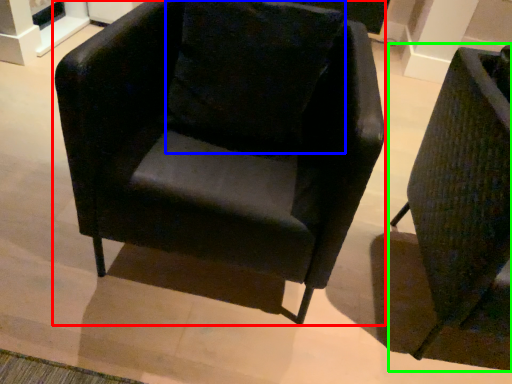
Question: Based on their relative distances, which object is nearer to chair (highlighted by a red box)? Choose from pillow (highlighted by a blue box) and chair (highlighted by a green box).

Choices:
 (A) pillow
 (B) chair

Answer: (A)